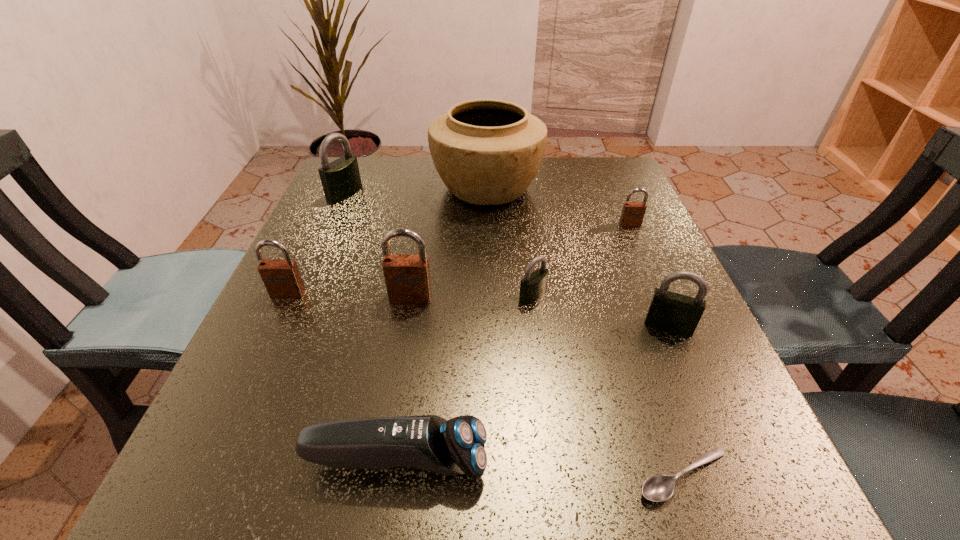
This screenshot has width=960, height=540. I want to click on object at the far left corner, so click(x=340, y=179).

The image size is (960, 540). I want to click on object that is at the near left corner, so click(x=456, y=446).

You are a GUI agent. You are given a task and a screenshot of the screen. Output one action in this format:
    pyautogui.click(x=<x>, y=<y>)
    Task: Click on the object situated at the near right corner
    The image size is (960, 540).
    Given the screenshot: What is the action you would take?
    pyautogui.click(x=657, y=488)

The height and width of the screenshot is (540, 960). In order to click on vacant space at the far edge in this screenshot , I will do `click(422, 172)`.

This screenshot has height=540, width=960. What are the coordinates of `vacant area at the left edge of the desktop` in the screenshot? It's located at pos(321,266).

Image resolution: width=960 pixels, height=540 pixels. Identify the location of vacant space at the right edge. (640, 258).

The image size is (960, 540). In the image, there is a desktop. In order to click on free space at the far left corner in this screenshot , I will do `click(371, 164)`.

Where is `free spot at the near left corner of the desktop`? free spot at the near left corner of the desktop is located at coordinates (237, 452).

Find the location of a particular element. This screenshot has width=960, height=540. free location at the far right corner of the desktop is located at coordinates (609, 158).

Find the location of a particular element. Image resolution: width=960 pixels, height=540 pixels. empty location between the farthest brown padlock and the second biggest brown padlock is located at coordinates (459, 259).